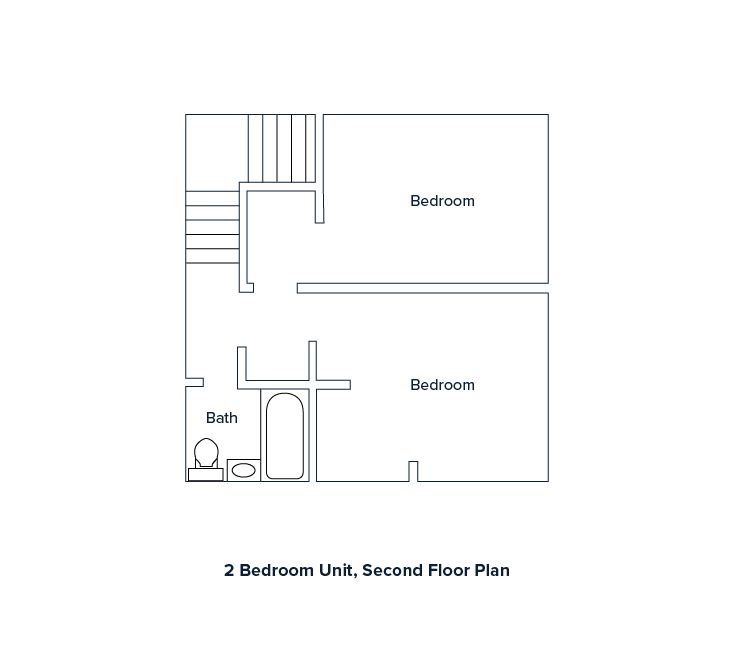
You are a GUI agent. You are given a task and a screenshot of the screen. Output one action in this format:
    pyautogui.click(x=<x>, y=<y>)
    Task: Click on the outline of a bathroom sink
    This screenshot has height=649, width=734.
    Given the screenshot: What is the action you would take?
    pyautogui.click(x=252, y=471)